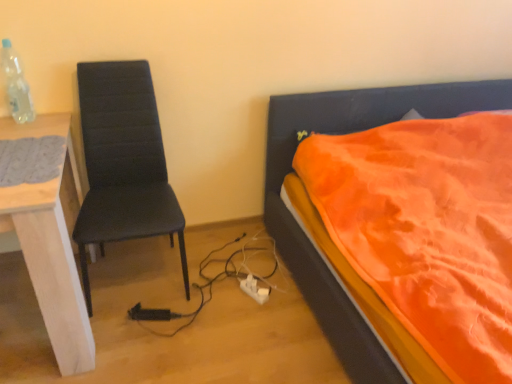
The image size is (512, 384). In order to click on free space between matte black chair at left and white plastic power plugs and sockets at lower center in this screenshot , I will do `click(212, 284)`.